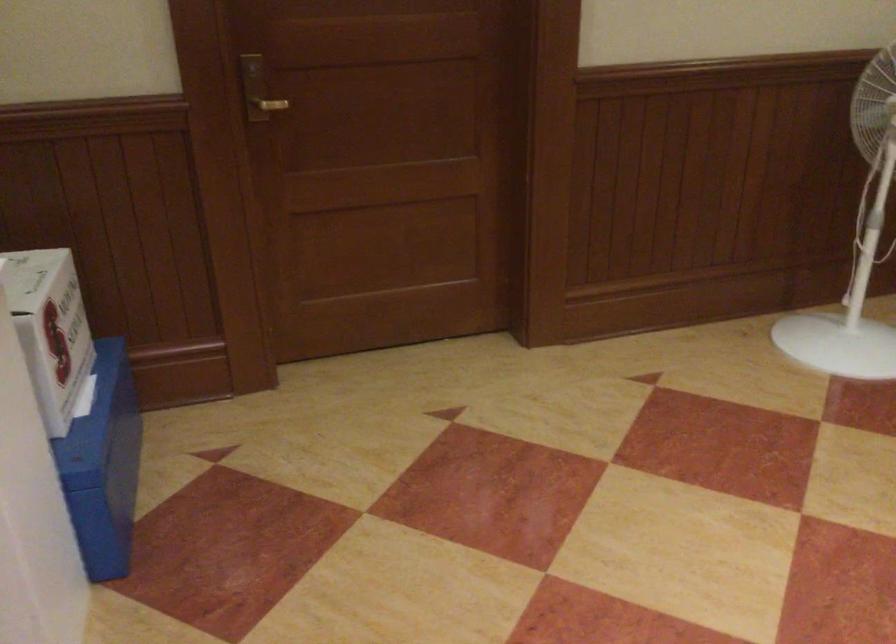
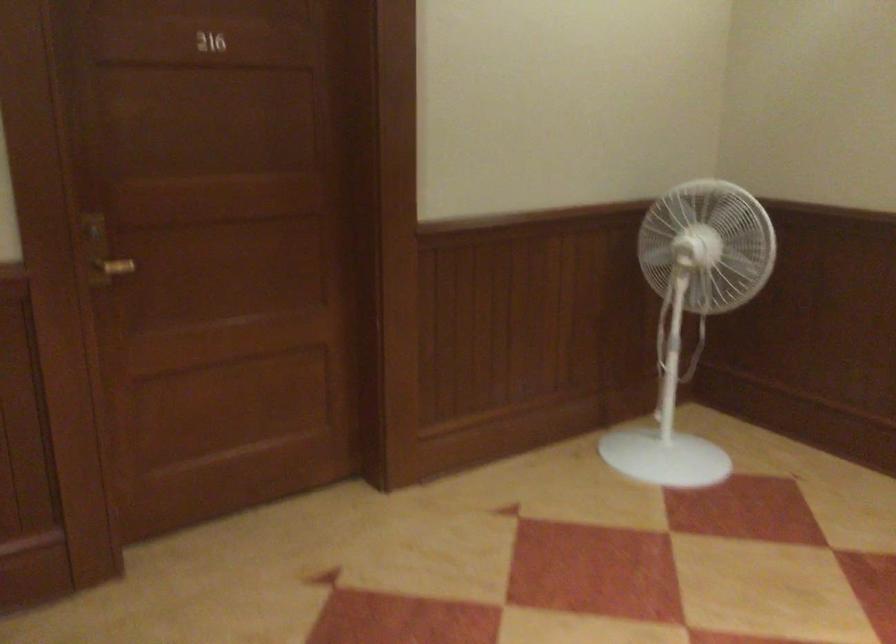
Question: What movement of the cameraman would produce the second image?

Choices:
 (A) Left
 (B) Right
 (C) Forward
 (D) Backward

Answer: (A)